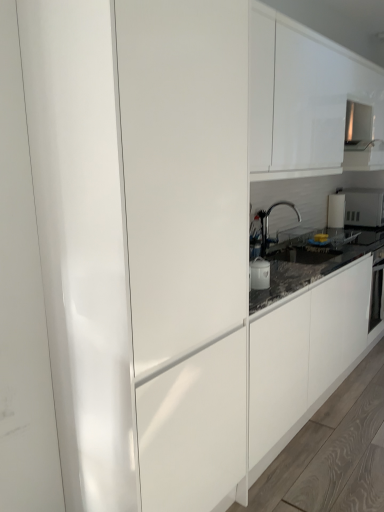
Measure the distance between satin nickel faucet at center and camera.

7.81 feet.

Identify the location of white glossy microwave at upper right, which is counted as the first appliance, starting from the top. The height and width of the screenshot is (512, 384). (363, 206).

I want to click on satin nickel faucet at center, so 267,221.

Is white glossy microwave at upper right, marked as the 2th appliance in a left-to-right arrangement, oriented away from white glossy cabinet at upper center?

No, white glossy cabinet at upper center is not at the back of white glossy microwave at upper right, marked as the 2th appliance in a left-to-right arrangement.

Would you consider white glossy microwave at upper right, which ranks as the 2th appliance in bottom-to-top order, to be distant from white glossy cabinet at upper center?

Indeed, white glossy microwave at upper right, which ranks as the 2th appliance in bottom-to-top order, is not near white glossy cabinet at upper center.

Is white glossy cabinet at upper center inside white glossy microwave at upper right, which ranks as the first appliance in right-to-left order?

No, white glossy microwave at upper right, which ranks as the first appliance in right-to-left order, does not contain white glossy cabinet at upper center.

Which object is more forward, white glossy microwave at upper right, which is counted as the first appliance, starting from the top, or white glossy cabinet at upper center?

white glossy cabinet at upper center is closer to the camera.

Is white glossy pot at center, which is the 2th appliance from right to left, to the right of satin nickel faucet at center from the viewer's perspective?

Incorrect, white glossy pot at center, which is the 2th appliance from right to left, is not on the right side of satin nickel faucet at center.

From a real-world perspective, which object rests below the other?

white glossy pot at center, which is the 1th appliance from front to back.

Is white glossy pot at center, arranged as the 1th appliance when ordered from the bottom, far away from satin nickel faucet at center?

No.

The width and height of the screenshot is (384, 512). In the image, there is a satin nickel faucet at center. In order to click on appliance below it (from the image's perspective) in this screenshot , I will do `click(259, 274)`.

The height and width of the screenshot is (512, 384). Find the location of `cabinetry lying behind the matte white cabinet at center`. cabinetry lying behind the matte white cabinet at center is located at coordinates (303, 95).

Which object is positioned more to the left, white glossy cabinet at upper center or matte white cabinet at center?

From the viewer's perspective, matte white cabinet at center appears more on the left side.

What's the angular difference between white glossy cabinet at upper center and matte white cabinet at center's facing directions?

They differ by 0.000498 degrees in their facing directions.

There is a satin nickel faucet at center. Where is `glass door above it (from a real-world perspective)`? glass door above it (from a real-world perspective) is located at coordinates (186, 241).

Does satin nickel faucet at center have a lesser width compared to matte white cabinet at center?

Indeed, satin nickel faucet at center has a lesser width compared to matte white cabinet at center.

Is satin nickel faucet at center shorter than matte white cabinet at center?

Yes.

How many degrees apart are the facing directions of white glossy pot at center, which is the 1th appliance from front to back, and matte white cabinet at center?

white glossy pot at center, which is the 1th appliance from front to back, and matte white cabinet at center are facing 0.00228 degrees away from each other.

Based on the photo, from the image's perspective, which is above, white glossy pot at center, placed as the 2th appliance when sorted from top to bottom, or matte white cabinet at center?

matte white cabinet at center is shown above in the image.

Is white glossy pot at center, the 2th appliance when ordered from back to front, positioned far away from matte white cabinet at center?

No, white glossy pot at center, the 2th appliance when ordered from back to front, is not far from matte white cabinet at center.

Is white glossy cabinet at upper center placed right next to white glossy pot at center, arranged as the 1th appliance when ordered from the bottom?

No, white glossy cabinet at upper center is not making contact with white glossy pot at center, arranged as the 1th appliance when ordered from the bottom.

Does white glossy cabinet at upper center have a larger size compared to white glossy pot at center, which is the 2th appliance from right to left?

Indeed, white glossy cabinet at upper center has a larger size compared to white glossy pot at center, which is the 2th appliance from right to left.

Between point (275, 120) and point (255, 261), which one is positioned in front?

The point (275, 120) is in front.

From a real-world perspective, is white glossy cabinet at upper center physically above white glossy pot at center, which is the 2th appliance from right to left?

Yes, from a real-world perspective, white glossy cabinet at upper center is on top of white glossy pot at center, which is the 2th appliance from right to left.

Is matte white cabinet at center smaller than white glossy pot at center, the 2th appliance when ordered from back to front?

No, matte white cabinet at center is not smaller than white glossy pot at center, the 2th appliance when ordered from back to front.

Is point (228, 185) farther from camera compared to point (257, 271)?

No, it is not.

Based on their positions, is matte white cabinet at center located to the left or right of white glossy pot at center, which is the 1th appliance from front to back?

Based on their positions, matte white cabinet at center is located to the left of white glossy pot at center, which is the 1th appliance from front to back.

From the image's perspective, is matte white cabinet at center on top of white glossy pot at center, placed as the 2th appliance when sorted from top to bottom?

Yes, from the image's perspective, matte white cabinet at center is above white glossy pot at center, placed as the 2th appliance when sorted from top to bottom.

You are a GUI agent. You are given a task and a screenshot of the screen. Output one action in this format:
    pyautogui.click(x=<x>, y=<y>)
    Task: Click on the cabinetry in front of the white glossy microwave at upper right, which ranks as the 2th appliance in bottom-to-top order
    
    Given the screenshot: What is the action you would take?
    pyautogui.click(x=303, y=95)

Where is `tap on the right of white glossy pot at center, the 2th appliance when ordered from back to front`? The image size is (384, 512). tap on the right of white glossy pot at center, the 2th appliance when ordered from back to front is located at coordinates click(x=267, y=221).

Considering their positions, is matte white cabinet at center positioned closer to white glossy cabinet at upper center than white glossy microwave at upper right, which ranks as the 2th appliance in bottom-to-top order?

matte white cabinet at center.

In the scene shown: Considering their positions, is white glossy cabinet at upper center positioned closer to white glossy microwave at upper right, which is counted as the first appliance, starting from the top, than matte white cabinet at center?

white glossy cabinet at upper center is positioned closer to the anchor white glossy microwave at upper right, which is counted as the first appliance, starting from the top.

Based on their spatial positions, is satin nickel faucet at center or white glossy microwave at upper right, which is counted as the first appliance, starting from the top, further from matte white cabinet at center?

Based on the image, white glossy microwave at upper right, which is counted as the first appliance, starting from the top, appears to be further to matte white cabinet at center.

Looking at the image, which one is located closer to white glossy pot at center, placed as the 2th appliance when sorted from top to bottom, matte white cabinet at center or satin nickel faucet at center?

satin nickel faucet at center lies closer to white glossy pot at center, placed as the 2th appliance when sorted from top to bottom, than the other object.

Which object lies further to the anchor point white glossy cabinet at upper center, satin nickel faucet at center or white glossy pot at center, arranged as the 1th appliance when ordered from the bottom?

white glossy pot at center, arranged as the 1th appliance when ordered from the bottom, lies further to white glossy cabinet at upper center than the other object.

Considering their positions, is white glossy pot at center, which is the 1th appliance from front to back, positioned closer to satin nickel faucet at center than white glossy microwave at upper right, which ranks as the first appliance in right-to-left order?

The object closer to satin nickel faucet at center is white glossy pot at center, which is the 1th appliance from front to back.

Considering their positions, is white glossy cabinet at upper center positioned closer to white glossy pot at center, marked as the 1th appliance in a left-to-right arrangement, than matte white cabinet at center?

Based on the image, matte white cabinet at center appears to be nearer to white glossy pot at center, marked as the 1th appliance in a left-to-right arrangement.

Estimate the real-world distances between objects in this image. Which object is closer to white glossy microwave at upper right, the 1th appliance viewed from the back, white glossy pot at center, which is the 1th appliance from front to back, or matte white cabinet at center?

white glossy pot at center, which is the 1th appliance from front to back, lies closer to white glossy microwave at upper right, the 1th appliance viewed from the back, than the other object.

Where is `glass door between white glossy cabinet at upper center and white glossy pot at center, the 2th appliance when ordered from back to front, vertically`? glass door between white glossy cabinet at upper center and white glossy pot at center, the 2th appliance when ordered from back to front, vertically is located at coordinates click(x=186, y=241).

This screenshot has height=512, width=384. Identify the location of appliance between matte white cabinet at center and white glossy microwave at upper right, which ranks as the first appliance in right-to-left order, from front to back. (259, 274).

This screenshot has width=384, height=512. What are the coordinates of `appliance between matte white cabinet at center and satin nickel faucet at center in the front-back direction` in the screenshot? It's located at (259, 274).

At what (x,y) coordinates should I click in order to perform the action: click on cabinetry between matte white cabinet at center and satin nickel faucet at center along the z-axis. Please return your answer as a coordinate pair (x, y). Image resolution: width=384 pixels, height=512 pixels. Looking at the image, I should click on (303, 95).